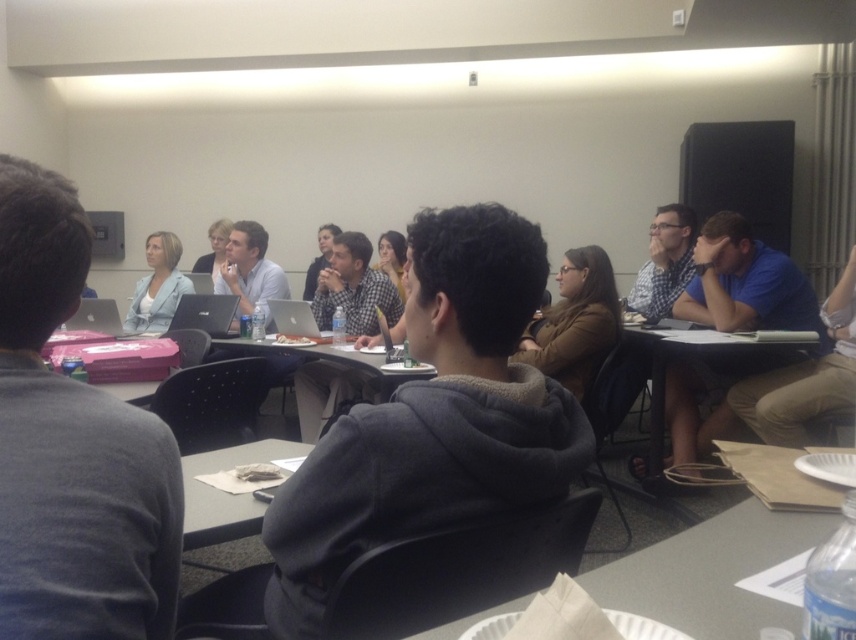
You are standing in the classroom and need to reach both the point at coordinates (123, 324) and the point at (218, 326). Which point should you approach first to reach the closer one first?

You should approach point (123, 324) first because it is closer to you than point (218, 326), which is further away.

You are standing in the classroom and want to reach both the point at coordinates (110, 308) and the point at coordinates (314, 289). Which point will you reach first if you move straight towards them?

You will reach the point at coordinates (110, 308) first because it is closer to you than the point at coordinates (314, 289).

In the classroom scene, there are two people wearing a gray fleece hoodie at center and a brown leather jacket at center. Which one is taller?

The gray fleece hoodie at center is taller than the brown leather jacket at center.